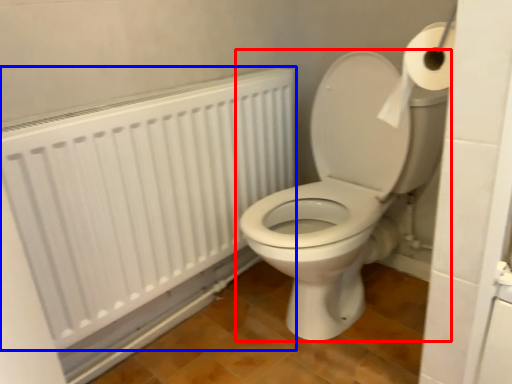
Question: Which object is closer to the camera taking this photo, toilet (highlighted by a red box) or radiator (highlighted by a blue box)?

Choices:
 (A) toilet
 (B) radiator

Answer: (A)